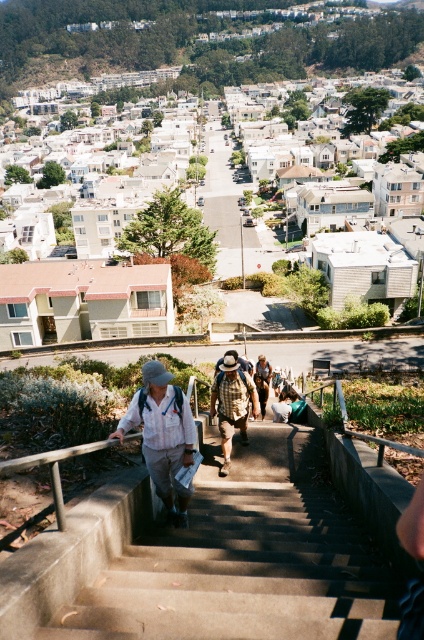
This screenshot has width=424, height=640. Find the location of `concrete stairs at center`. concrete stairs at center is located at coordinates (247, 557).

Between concrete stairs at center and white cotton shirt at center, which one is positioned higher?

Positioned higher is white cotton shirt at center.

Is point (307, 557) closer to camera compared to point (161, 424)?

Yes.

In order to click on concrete stairs at center in this screenshot , I will do [247, 557].

Is point (310, 456) behind point (233, 401)?

Yes, point (310, 456) is farther from viewer.

Looking at this image, is concrete stairs at center above camouflage-patterned backpack at center?

No.

Locate an element on the screen. The width and height of the screenshot is (424, 640). concrete stairs at center is located at coordinates (247, 557).

Is white cotton shirt at center above camouflage-patterned backpack at center?

No, white cotton shirt at center is not above camouflage-patterned backpack at center.

Is white cotton shirt at center shorter than camouflage-patterned backpack at center?

Incorrect, white cotton shirt at center's height does not fall short of camouflage-patterned backpack at center's.

Measure the distance between white cotton shirt at center and camera.

white cotton shirt at center and camera are 9.31 meters apart.

Identify the location of white cotton shirt at center. The height and width of the screenshot is (640, 424). (162, 435).